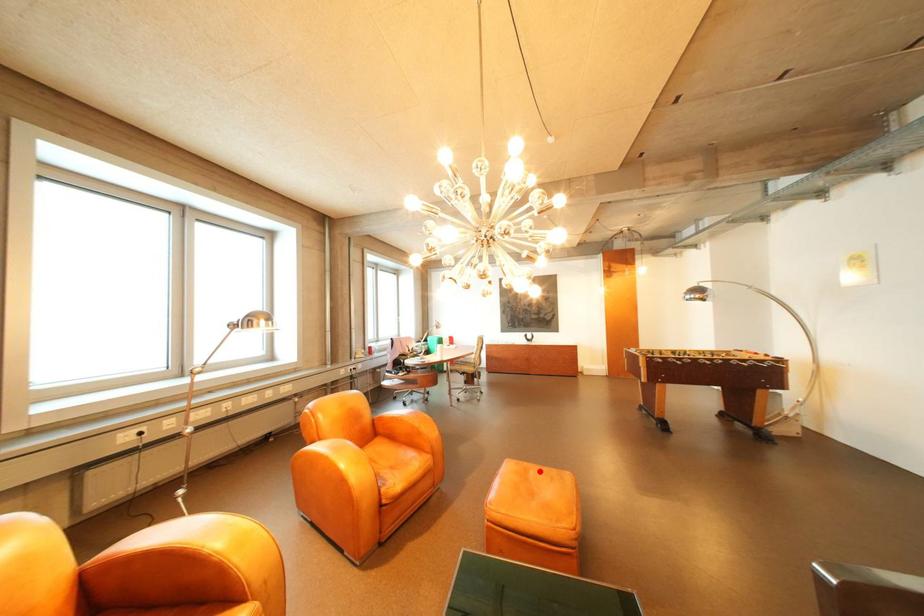
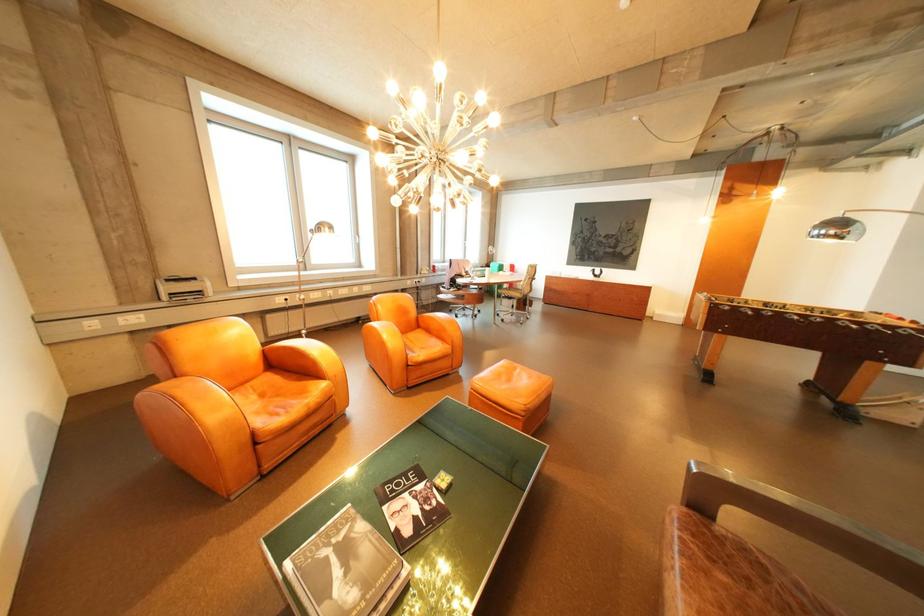
Where in the second image is the point corresponding to the highlighted location from the first image?

(528, 370)